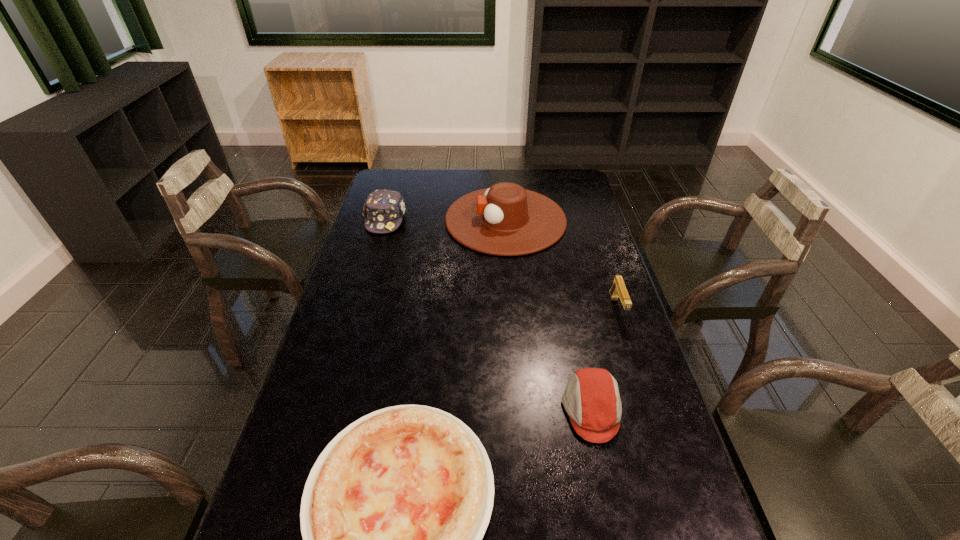
Image resolution: width=960 pixels, height=540 pixels. What are the coordinates of `cowboy hat` in the screenshot? It's located at (506, 220).

At what (x,y) coordinates should I click in order to perform the action: click on the left cap. Please return your answer as a coordinate pair (x, y). The image size is (960, 540). Looking at the image, I should click on (383, 209).

Where is `pistol`? pistol is located at coordinates (618, 289).

At what (x,y) coordinates should I click in order to perform the action: click on the rightmost object. Please return your answer as a coordinate pair (x, y). Looking at the image, I should click on (618, 289).

The height and width of the screenshot is (540, 960). I want to click on the shorter cap, so click(591, 399).

You are a GUI agent. You are given a task and a screenshot of the screen. Output one action in this format:
    pyautogui.click(x=<x>, y=<y>)
    Task: Click on the nearer cap
    This screenshot has height=540, width=960.
    Given the screenshot: What is the action you would take?
    pyautogui.click(x=591, y=399)

Find the location of `free location located on the front-facing side of the cowboy hat`. free location located on the front-facing side of the cowboy hat is located at coordinates (378, 220).

Identify the location of free location located 0.180m on the front-facing side of the cowboy hat. The height and width of the screenshot is (540, 960). [399, 220].

Find the location of a particular element. vacant space positioned 0.200m on the front-facing side of the cowboy hat is located at coordinates (394, 220).

The height and width of the screenshot is (540, 960). I want to click on blank space located on the front-facing side of the farther cap, so point(370,274).